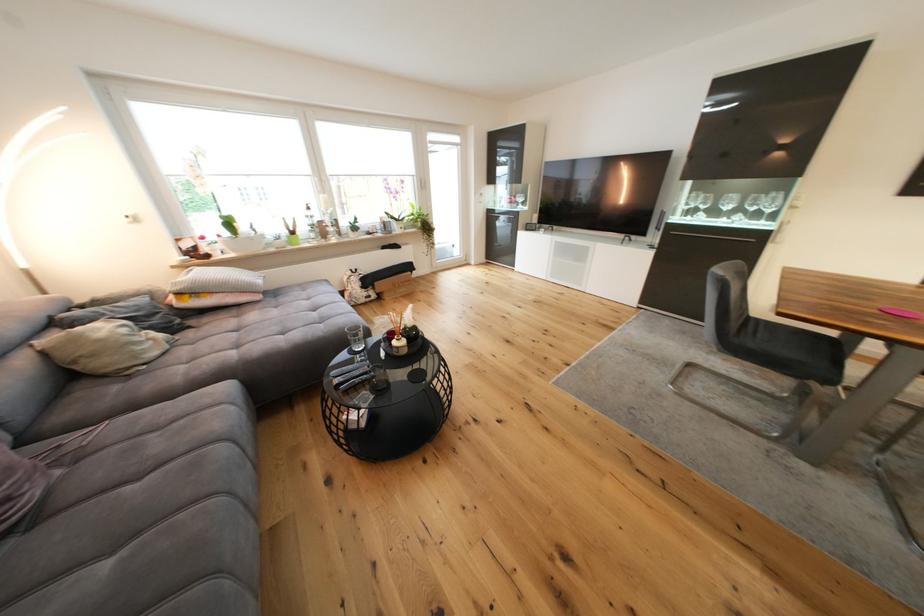
The height and width of the screenshot is (616, 924). Find the location of `sofa sitting surface`. sofa sitting surface is located at coordinates (264, 330).